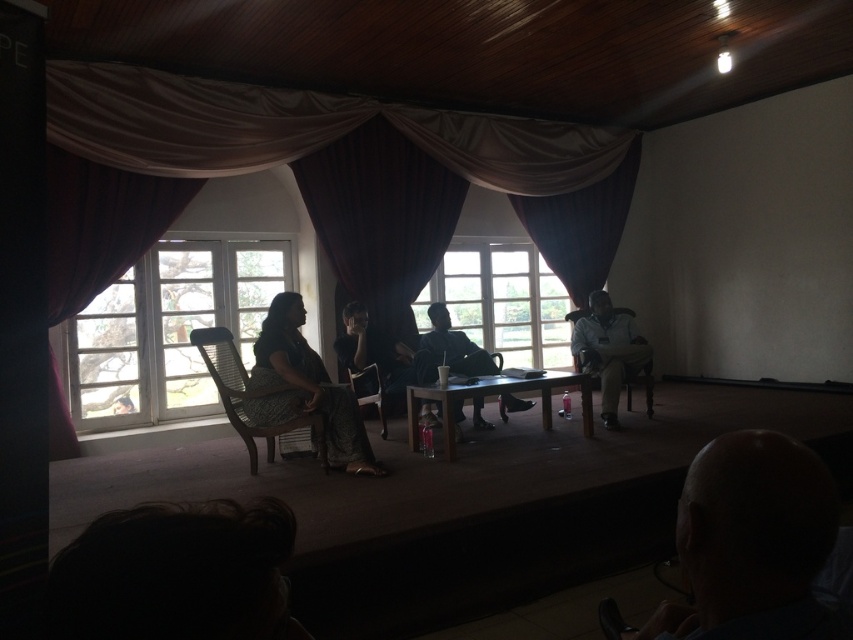
Question: Is bald head at lower right to the left of dark fabric jacket at center from the viewer's perspective?

Choices:
 (A) yes
 (B) no

Answer: (B)

Question: Is patterned fabric dress at center below wooden table at center?

Choices:
 (A) yes
 (B) no

Answer: (B)

Question: Which point is closer to the camera?

Choices:
 (A) woven wood chair at center
 (B) bald head at lower right

Answer: (B)

Question: Which point is farther to the camera?

Choices:
 (A) matte black shirt at center
 (B) wooden textured chair at center
 (C) wooden table at center

Answer: (A)

Question: Can you confirm if wooden table at center is positioned below wooden chair at center?

Choices:
 (A) no
 (B) yes

Answer: (B)

Question: Which of the following is the closest to the observer?

Choices:
 (A) (277, 348)
 (B) (90, 280)
 (C) (650, 353)
 (D) (219, 368)

Answer: (A)